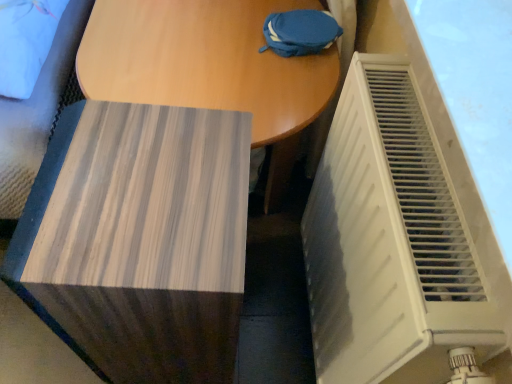
Question: Is point (271, 142) positioned closer to the camera than point (372, 291)?

Choices:
 (A) farther
 (B) closer

Answer: (A)

Question: Considering their positions, is wooden table at center located in front of or behind white plastic radiator at right?

Choices:
 (A) front
 (B) behind

Answer: (B)

Question: Which is nearer to the white plastic radiator at right?

Choices:
 (A) wooden table at center
 (B) wooden side table at lower left

Answer: (B)

Question: Estimate the real-world distances between objects in this image. Which object is farther from the white plastic radiator at right?

Choices:
 (A) wooden side table at lower left
 (B) wooden table at center

Answer: (B)